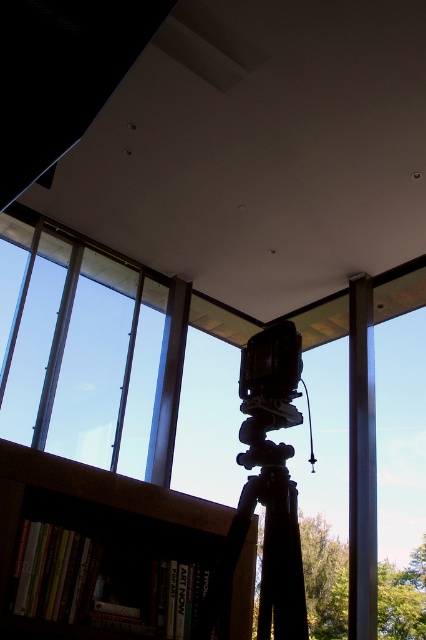
Does transparent glass window at left have a greater width compared to black matte tripod at center?

Correct, the width of transparent glass window at left exceeds that of black matte tripod at center.

Which is in front, point (155, 323) or point (278, 632)?

Point (278, 632)

This screenshot has width=426, height=640. I want to click on transparent glass window at left, so click(x=80, y=352).

Does point (265, 608) come farther from viewer compared to point (232, 509)?

No, (265, 608) is closer to viewer.

Who is more forward, (293,627) or (63,484)?

Positioned in front is point (293,627).

Identify the location of black matte tripod at center. The image size is (426, 640). (264, 540).

Between black matte tripod at center and metallic pole at center, which one appears on the right side from the viewer's perspective?

metallic pole at center

Looking at this image, does black matte tripod at center have a smaller size compared to metallic pole at center?

Yes, black matte tripod at center is smaller than metallic pole at center.

Between point (258, 433) and point (348, 385), which one is positioned in front?

Point (258, 433) is more forward.

You are a GUI agent. You are given a task and a screenshot of the screen. Output one action in this format:
    pyautogui.click(x=<x>, y=<y>)
    Task: Click on the black matte tripod at center
    
    Given the screenshot: What is the action you would take?
    pyautogui.click(x=264, y=540)